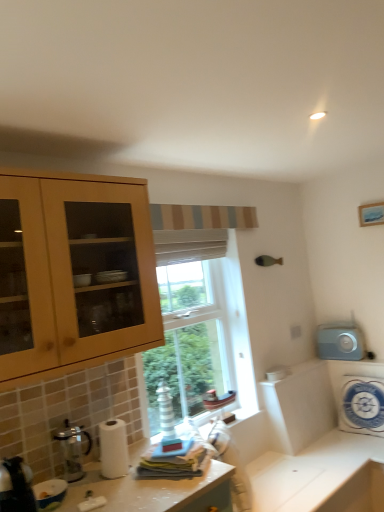
Question: Based on their sizes in the image, would you say white glossy countertop at lower center is bigger or smaller than white fabric cushion at right, acting as the fourth appliance starting from the left?

Choices:
 (A) big
 (B) small

Answer: (A)

Question: Relative to white fabric cushion at right, the second appliance when ordered from back to front, is white glossy countertop at lower center in front or behind?

Choices:
 (A) front
 (B) behind

Answer: (A)

Question: Which is farther from the white fabric cushion at right, the third appliance positioned from the front?

Choices:
 (A) white glossy bowl at lower left, which is counted as the third appliance, starting from the right
 (B) metallic silver coffee maker at lower left
 (C) white glossy countertop at lower center
 (D) metallic silver kettle at lower left, placed as the 1th appliance when sorted from left to right
 (E) gray matte clock at right, arranged as the third appliance when viewed from the left

Answer: (D)

Question: Considering the real-world distances, which object is closest to the white textured curtain at window?

Choices:
 (A) metallic silver kettle at lower left, placed as the 1th appliance when sorted from left to right
 (B) metallic silver coffee maker at lower left
 (C) white glossy bowl at lower left, which is counted as the third appliance, starting from the right
 (D) white glossy countertop at lower center
 (E) white fabric cushion at right, the second appliance when ordered from back to front

Answer: (B)